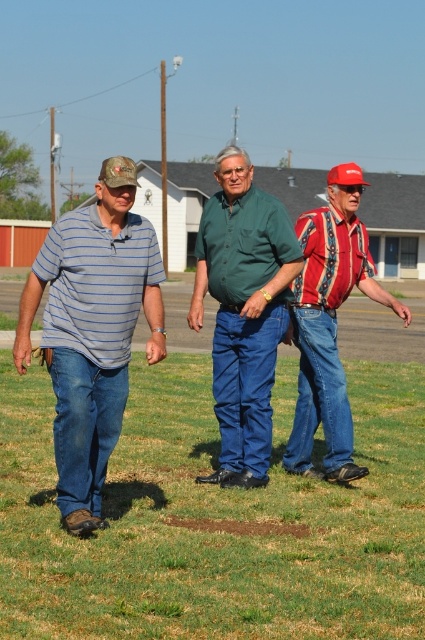
Question: Can you confirm if green grass at center is smaller than red plaid shirt at center?

Choices:
 (A) no
 (B) yes

Answer: (A)

Question: Can you confirm if green grass at center is positioned below striped cotton shirt at left?

Choices:
 (A) no
 (B) yes

Answer: (B)

Question: Which point is farther from the camera taking this photo?

Choices:
 (A) (294, 259)
 (B) (314, 232)
 (C) (201, 582)

Answer: (B)

Question: Can you confirm if green grass at center is thinner than striped cotton shirt at left?

Choices:
 (A) yes
 (B) no

Answer: (B)

Question: Based on their relative distances, which object is nearer to the striped cotton shirt at left?

Choices:
 (A) red plaid shirt at center
 (B) green grass at center
 (C) green cotton shirt at center

Answer: (C)

Question: Which point is closer to the camera taking this photo?

Choices:
 (A) (255, 209)
 (B) (102, 438)

Answer: (B)